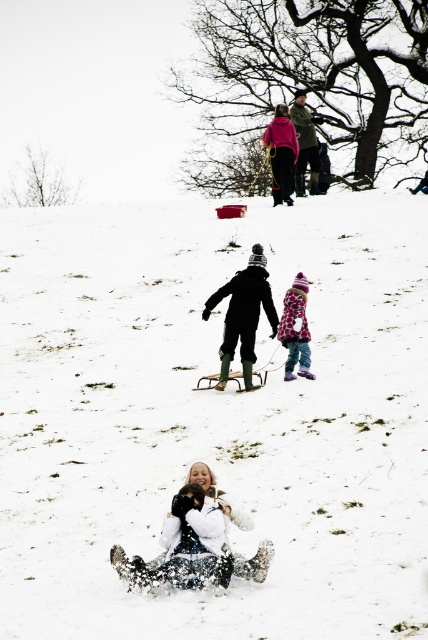
Question: Where is black rubber boots at center located in relation to pink fleece jacket at upper center in the image?

Choices:
 (A) right
 (B) left

Answer: (B)

Question: Which point appears farthest from the camera in this image?

Choices:
 (A) (303, 144)
 (B) (282, 145)
 (C) (265, 301)

Answer: (A)

Question: Which point appears farthest from the camera in this image?

Choices:
 (A) (222, 536)
 (B) (290, 134)
 (C) (285, 372)

Answer: (B)

Question: Can you confirm if black rubber boots at center is thinner than dark green jacket at upper center?

Choices:
 (A) no
 (B) yes

Answer: (B)

Question: Based on their relative distances, which object is farther from the black rubber boots at center?

Choices:
 (A) white fluffy coat at lower center
 (B) white fluffy snow at center
 (C) pink fleece jacket at upper center
 (D) plaid fabric coat at center

Answer: (C)

Question: Does white fluffy snow at center appear under pink fleece jacket at upper center?

Choices:
 (A) no
 (B) yes

Answer: (B)